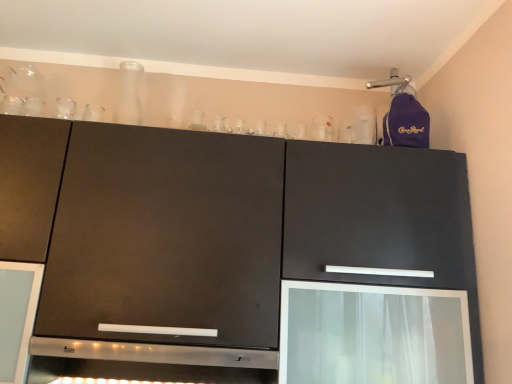
Question: Is transparent glass screen door at lower right behind matte black cabinet at upper center?

Choices:
 (A) yes
 (B) no

Answer: (A)

Question: From a real-world perspective, is transparent glass screen door at lower right located beneath matte black cabinet at upper center?

Choices:
 (A) no
 (B) yes

Answer: (B)

Question: Can you confirm if transparent glass screen door at lower right is thinner than matte black cabinet at upper center?

Choices:
 (A) yes
 (B) no

Answer: (A)

Question: Does transparent glass screen door at lower right have a greater height compared to matte black cabinet at upper center?

Choices:
 (A) yes
 (B) no

Answer: (B)

Question: Is transparent glass screen door at lower right at the left side of matte black cabinet at upper center?

Choices:
 (A) yes
 (B) no

Answer: (B)

Question: From the image's perspective, is transparent glass screen door at lower right under matte black cabinet at upper center?

Choices:
 (A) no
 (B) yes

Answer: (B)

Question: Can you confirm if transparent glass carafe at upper center is positioned to the right of transparent glass screen door at lower right?

Choices:
 (A) no
 (B) yes

Answer: (A)

Question: Does transparent glass carafe at upper center have a smaller size compared to transparent glass screen door at lower right?

Choices:
 (A) no
 (B) yes

Answer: (B)

Question: From the image's perspective, is transparent glass carafe at upper center on transparent glass screen door at lower right?

Choices:
 (A) yes
 (B) no

Answer: (A)

Question: From a real-world perspective, is transparent glass carafe at upper center beneath transparent glass screen door at lower right?

Choices:
 (A) yes
 (B) no

Answer: (B)

Question: Considering the relative positions of transparent glass carafe at upper center and transparent glass screen door at lower right in the image provided, is transparent glass carafe at upper center to the left of transparent glass screen door at lower right from the viewer's perspective?

Choices:
 (A) yes
 (B) no

Answer: (A)

Question: From a real-world perspective, is transparent glass carafe at upper center over transparent glass screen door at lower right?

Choices:
 (A) no
 (B) yes

Answer: (B)

Question: Is transparent glass carafe at upper center at the back of transparent glass screen door at lower right?

Choices:
 (A) no
 (B) yes

Answer: (A)